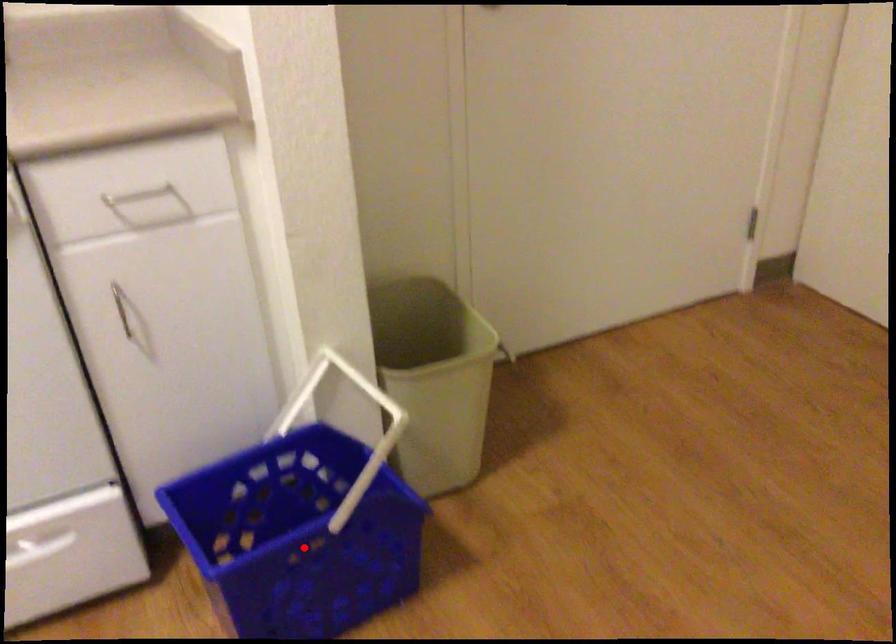
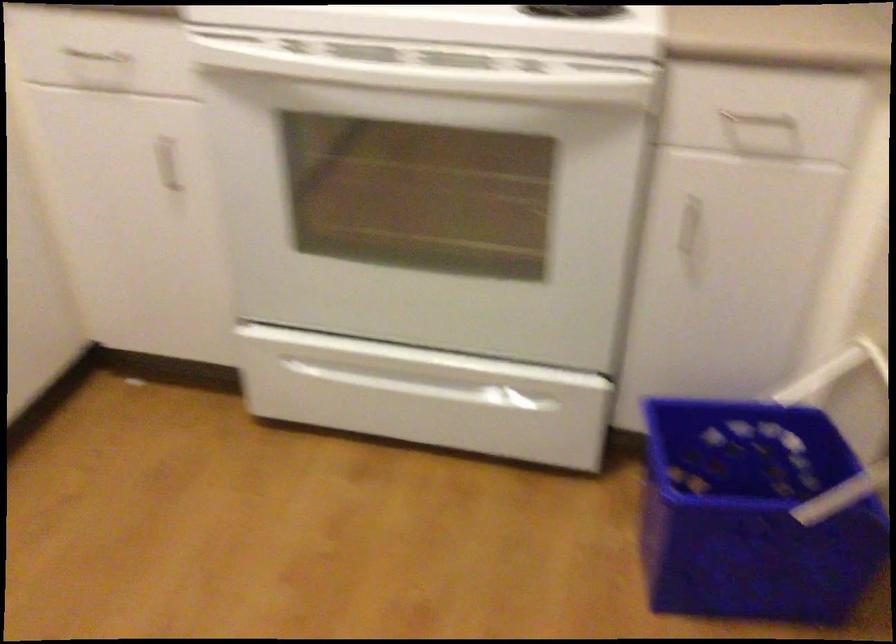
The point at the highlighted location is marked in the first image. Where is the corresponding point in the second image?

(752, 514)